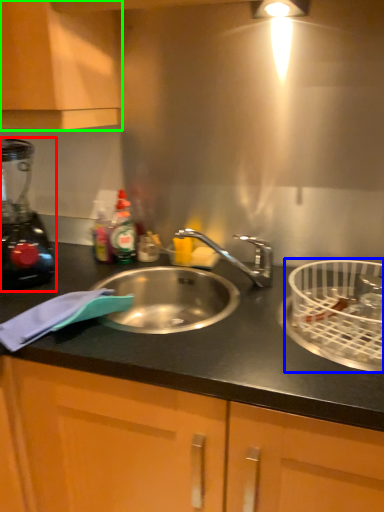
Question: Which is nearer to the blender (highlighted by a red box)? basket (highlighted by a blue box) or cabinetry (highlighted by a green box).

Choices:
 (A) basket
 (B) cabinetry

Answer: (B)